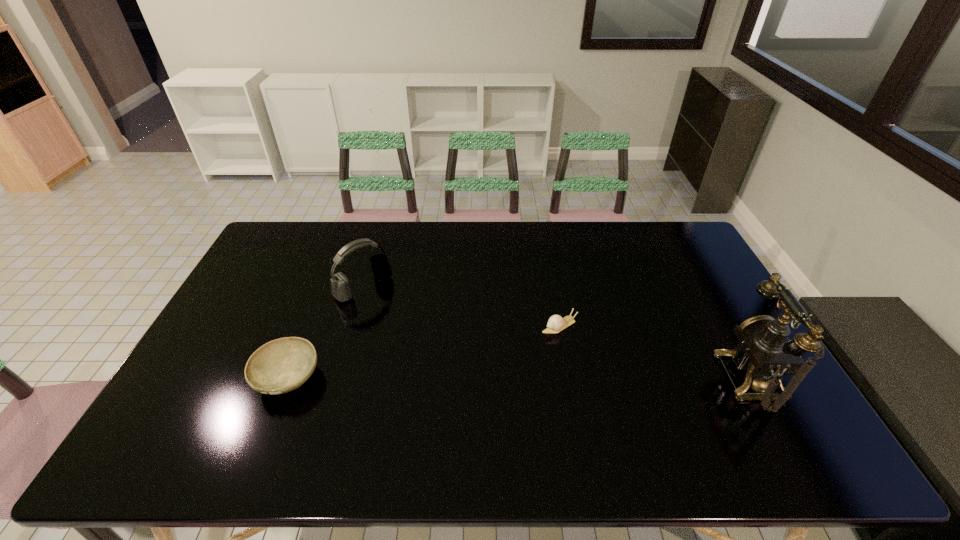
Find the location of a particular element. The height and width of the screenshot is (540, 960). free space between the tallest object and the headset is located at coordinates (559, 333).

Find the location of a particular element. This screenshot has width=960, height=540. blank region between the rightmost object and the farthest object is located at coordinates [x=559, y=333].

Locate an element on the screen. Image resolution: width=960 pixels, height=540 pixels. free point between the third shortest object and the rightmost object is located at coordinates (559, 333).

Identify which object is the second closest to the bowl. Please provide its 2D coordinates. Your answer should be formatted as a tuple, i.e. [(x, y)], where the tuple contains the x and y coordinates of a point satisfying the conditions above.

[(556, 323)]

At what (x,y) coordinates should I click in order to perform the action: click on object that stands as the third closest to the headset. Please return your answer as a coordinate pair (x, y). The width and height of the screenshot is (960, 540). Looking at the image, I should click on (765, 352).

I want to click on vacant space that satisfies the following two spatial constraints: 1. on the back side of the farthest object; 2. on the left side of the bowl, so click(324, 287).

Locate an element on the screen. Image resolution: width=960 pixels, height=540 pixels. vacant region that satisfies the following two spatial constraints: 1. on the front side of the farthest object; 2. on the rotary dial of the rightmost object is located at coordinates (337, 379).

In order to click on free space in the image that satisfies the following two spatial constraints: 1. on the front side of the third object from left to right; 2. on the rotary dial of the tallest object in this screenshot , I will do [569, 379].

Identify the location of free region that satisfies the following two spatial constraints: 1. on the front side of the second shortest object; 2. on the rotary dial of the rightmost object. Image resolution: width=960 pixels, height=540 pixels. (287, 379).

Locate an element on the screen. The height and width of the screenshot is (540, 960). free spot that satisfies the following two spatial constraints: 1. on the front side of the bowl; 2. on the rotary dial of the telephone is located at coordinates (287, 379).